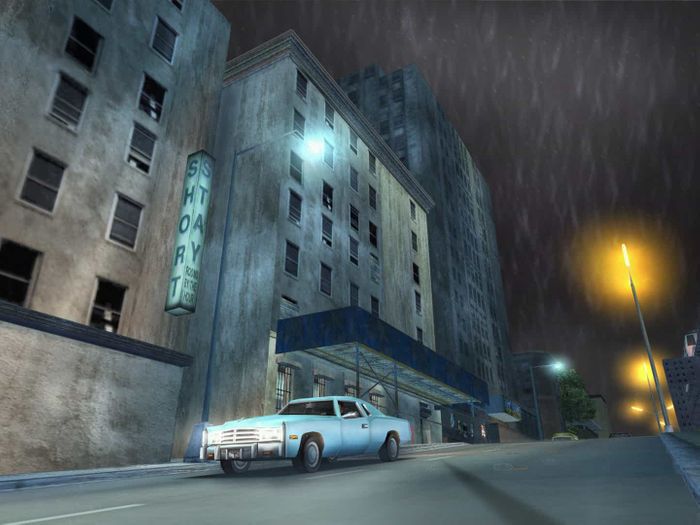
Locate an element on the screen. The height and width of the screenshot is (525, 700). yellow light is located at coordinates (640, 408), (666, 407), (661, 423), (644, 369), (623, 275), (624, 253).